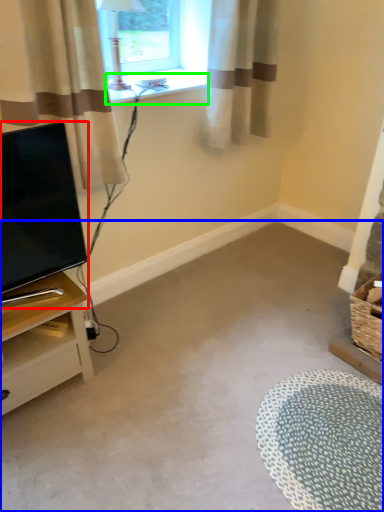
Question: Which object is positioned farthest from television (highlighted by a red box)? Select from plain (highlighted by a blue box) and window sill (highlighted by a green box).

Choices:
 (A) plain
 (B) window sill

Answer: (A)